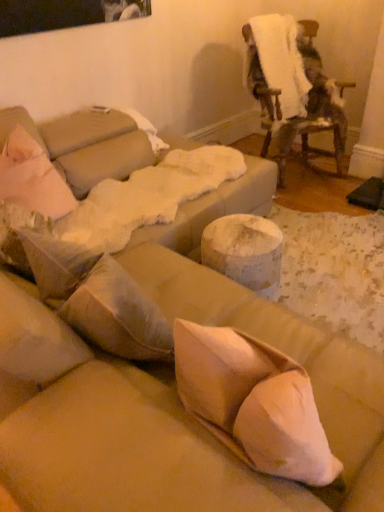
At what (x,y) coordinates should I click in order to perform the action: click on fuzzy white blanket at upper right. Please return your answer as a coordinate pair (x, y). Image resolution: width=384 pixels, height=512 pixels. Looking at the image, I should click on (314, 110).

Describe the element at coordinates (314, 110) in the screenshot. I see `fuzzy white blanket at upper right` at that location.

What do you see at coordinates (281, 61) in the screenshot? I see `white fluffy blanket at upper right` at bounding box center [281, 61].

You are a GUI agent. You are given a task and a screenshot of the screen. Output one action in this format:
    pyautogui.click(x=<x>, y=<y>)
    Task: Click on the white fluffy blanket at upper right
    Image resolution: width=384 pixels, height=512 pixels.
    Given the screenshot: What is the action you would take?
    pyautogui.click(x=281, y=61)

At what (x,y) coordinates should I click in order to perform the action: click on fuzzy white blanket at upper right. Please return your answer as a coordinate pair (x, y). This screenshot has width=384, height=512. Looking at the image, I should click on (314, 110).

Considering the relative positions of fuzzy white blanket at upper right and white fluffy blanket at upper right in the image provided, is fuzzy white blanket at upper right to the right of white fluffy blanket at upper right from the viewer's perspective?

Indeed, fuzzy white blanket at upper right is positioned on the right side of white fluffy blanket at upper right.

Is the depth of fuzzy white blanket at upper right less than that of white fluffy blanket at upper right?

Yes, fuzzy white blanket at upper right is in front of white fluffy blanket at upper right.

Which point is more forward, (275, 114) or (292, 77)?

Point (275, 114)

From the image's perspective, is fuzzy white blanket at upper right positioned above or below white fluffy blanket at upper right?

fuzzy white blanket at upper right is situated lower than white fluffy blanket at upper right in the image.

From a real-world perspective, is fuzzy white blanket at upper right under white fluffy blanket at upper right?

Yes.

Between fuzzy white blanket at upper right and white fluffy blanket at upper right, which one has larger width?

Wider between the two is fuzzy white blanket at upper right.

Which of these two, fuzzy white blanket at upper right or white fluffy blanket at upper right, stands shorter?

Standing shorter between the two is white fluffy blanket at upper right.

Which of these two, fuzzy white blanket at upper right or white fluffy blanket at upper right, is smaller?

Smaller between the two is white fluffy blanket at upper right.

Would you say fuzzy white blanket at upper right is inside or outside white fluffy blanket at upper right?

fuzzy white blanket at upper right is not enclosed by white fluffy blanket at upper right.

Are fuzzy white blanket at upper right and white fluffy blanket at upper right far apart?

They are positioned close to each other.

Is fuzzy white blanket at upper right oriented towards white fluffy blanket at upper right?

No, fuzzy white blanket at upper right is not turned towards white fluffy blanket at upper right.

Measure the distance from fuzzy white blanket at upper right to white fluffy blanket at upper right.

A distance of 5.36 inches exists between fuzzy white blanket at upper right and white fluffy blanket at upper right.

I want to click on linen above the fuzzy white blanket at upper right (from the image's perspective), so click(281, 61).

Between white fluffy blanket at upper right and fuzzy white blanket at upper right, which one appears on the left side from the viewer's perspective?

Positioned to the left is white fluffy blanket at upper right.

Is white fluffy blanket at upper right positioned behind fuzzy white blanket at upper right?

Yes, white fluffy blanket at upper right is behind fuzzy white blanket at upper right.

Does point (302, 64) come behind point (280, 134)?

Yes, point (302, 64) is behind point (280, 134).

From the image's perspective, does white fluffy blanket at upper right appear higher than fuzzy white blanket at upper right?

Yes, from the image's perspective, white fluffy blanket at upper right is over fuzzy white blanket at upper right.

From a real-world perspective, is white fluffy blanket at upper right physically below fuzzy white blanket at upper right?

Incorrect, from a real-world perspective, white fluffy blanket at upper right is higher than fuzzy white blanket at upper right.

Considering the sizes of white fluffy blanket at upper right and fuzzy white blanket at upper right in the image, is white fluffy blanket at upper right wider or thinner than fuzzy white blanket at upper right?

In the image, white fluffy blanket at upper right appears to be more narrow than fuzzy white blanket at upper right.

Who is shorter, white fluffy blanket at upper right or fuzzy white blanket at upper right?

white fluffy blanket at upper right.

In terms of size, does white fluffy blanket at upper right appear bigger or smaller than fuzzy white blanket at upper right?

Clearly, white fluffy blanket at upper right is smaller in size than fuzzy white blanket at upper right.

Could fuzzy white blanket at upper right be considered to be inside white fluffy blanket at upper right?

No, white fluffy blanket at upper right does not contain fuzzy white blanket at upper right.

Would you consider white fluffy blanket at upper right to be distant from fuzzy white blanket at upper right?

No.

Is white fluffy blanket at upper right positioned with its back to fuzzy white blanket at upper right?

Yes, fuzzy white blanket at upper right is at the back of white fluffy blanket at upper right.

What's the angular difference between white fluffy blanket at upper right and fuzzy white blanket at upper right's facing directions?

2.82 degrees.

Measure the distance from white fluffy blanket at upper right to fuzzy white blanket at upper right.

white fluffy blanket at upper right is 13.61 centimeters from fuzzy white blanket at upper right.

This screenshot has height=512, width=384. Find the location of `linen behind the fuzzy white blanket at upper right`. linen behind the fuzzy white blanket at upper right is located at coordinates (281, 61).

Locate an element on the screen. Image resolution: width=384 pixels, height=512 pixels. linen that is above the fuzzy white blanket at upper right (from the image's perspective) is located at coordinates (281, 61).

This screenshot has height=512, width=384. I want to click on linen on the left side of fuzzy white blanket at upper right, so click(x=281, y=61).